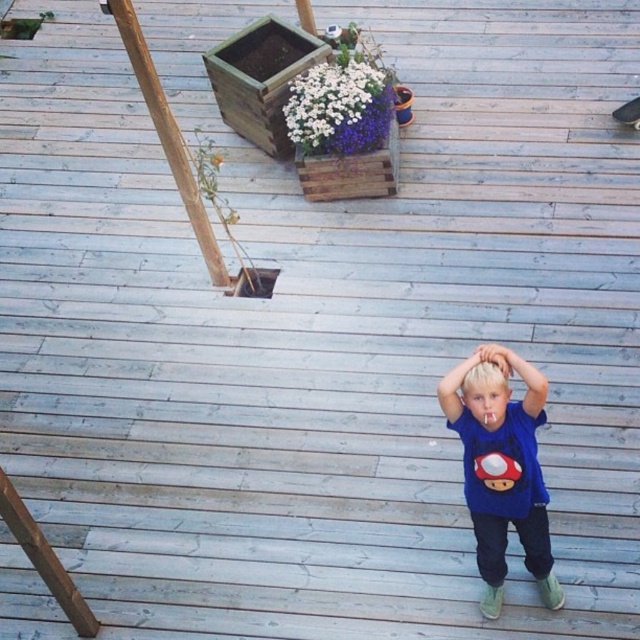
You are a photographer trying to capture a closeup of the blue cotton shirt at center and the smooth skin hand at center. Which object should you focus on first if you want to ensure both are in focus?

The blue cotton shirt at center is much taller than the smooth skin hand at center, so focusing on the blue cotton shirt at center first will help ensure both are in focus.

You are a photographer standing on the wooden deck. You notice a point at coordinates (500, 470). Which object is this point located on?

The point at coordinates (500, 470) is located on the blue cotton shirt at center.